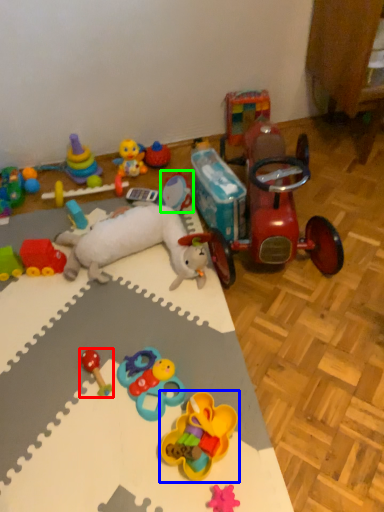
Question: Based on their relative distances, which object is nearer to toy (highlighted by a red box)? Choose from toy (highlighted by a blue box) and toy (highlighted by a green box).

Choices:
 (A) toy
 (B) toy

Answer: (A)